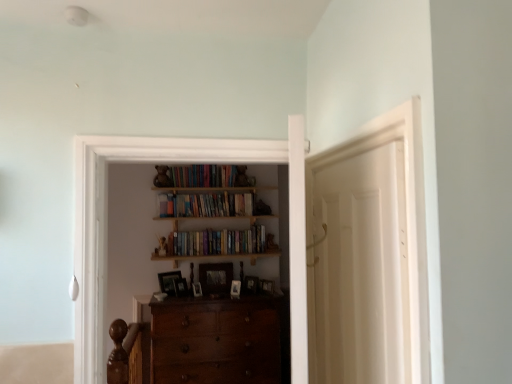
Question: Which direction should I rotate to look at wooden photo frame at center, the third picture frame when ordered from left to right, — up or down?

Choices:
 (A) up
 (B) down

Answer: (B)

Question: Does white matte door at center appear on the left side of shiny brown wooden chest of drawers at center?

Choices:
 (A) yes
 (B) no

Answer: (B)

Question: Can you see white matte door at center touching shiny brown wooden chest of drawers at center?

Choices:
 (A) no
 (B) yes

Answer: (A)

Question: Does white matte door at center have a lesser height compared to shiny brown wooden chest of drawers at center?

Choices:
 (A) no
 (B) yes

Answer: (A)

Question: Can you confirm if white matte door at center is thinner than shiny brown wooden chest of drawers at center?

Choices:
 (A) yes
 (B) no

Answer: (A)

Question: Does white matte door at center appear on the right side of shiny brown wooden chest of drawers at center?

Choices:
 (A) no
 (B) yes

Answer: (B)

Question: From the image's perspective, is white matte door at center over shiny brown wooden chest of drawers at center?

Choices:
 (A) no
 (B) yes

Answer: (B)

Question: Does shiny brown wooden chest of drawers at center have a smaller size compared to wooden photo frame at center, which is the first picture frame in left-to-right order?

Choices:
 (A) no
 (B) yes

Answer: (A)

Question: Is shiny brown wooden chest of drawers at center located outside wooden photo frame at center, the 7th picture frame from the right?

Choices:
 (A) no
 (B) yes

Answer: (B)

Question: Is shiny brown wooden chest of drawers at center wider than wooden photo frame at center, the 7th picture frame from the right?

Choices:
 (A) no
 (B) yes

Answer: (B)

Question: Is shiny brown wooden chest of drawers at center far from wooden photo frame at center, which is the first picture frame in left-to-right order?

Choices:
 (A) yes
 (B) no

Answer: (B)

Question: Can you confirm if shiny brown wooden chest of drawers at center is bigger than wooden photo frame at center, the 7th picture frame from the right?

Choices:
 (A) no
 (B) yes

Answer: (B)

Question: Is shiny brown wooden chest of drawers at center thinner than wooden photo frame at center, which is the first picture frame in left-to-right order?

Choices:
 (A) no
 (B) yes

Answer: (A)

Question: From the image's perspective, does wooden photo frame at center, the third picture frame when ordered from left to right, appear lower than wooden bookshelf at upper center, the first book from the top?

Choices:
 (A) yes
 (B) no

Answer: (A)